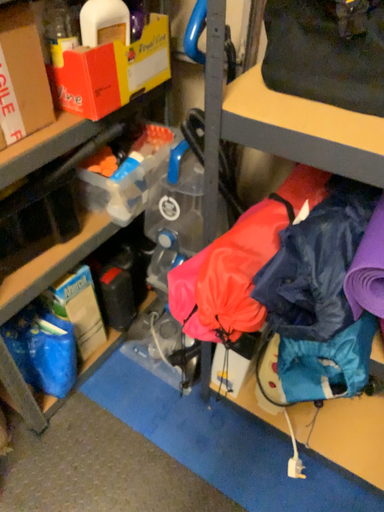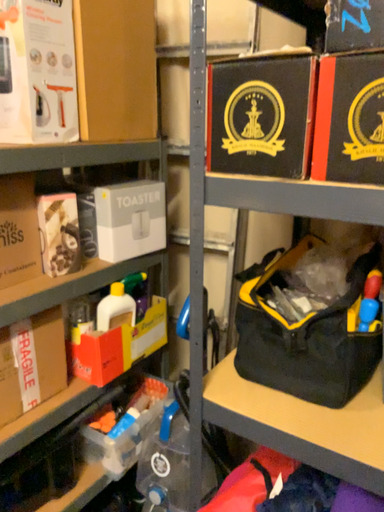
Question: How did the camera likely rotate when shooting the video?

Choices:
 (A) rotated upward
 (B) rotated downward

Answer: (A)